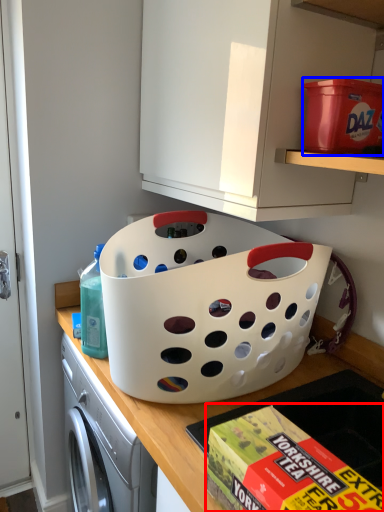
Question: Which object is further to the camera taking this photo, box (highlighted by a red box) or storage box (highlighted by a blue box)?

Choices:
 (A) box
 (B) storage box

Answer: (B)